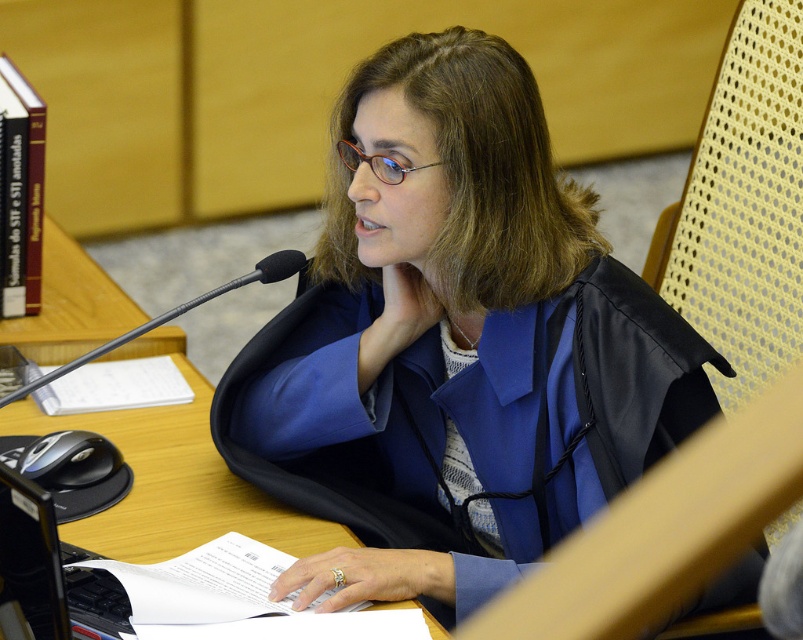
Which is more to the left, blue fabric at center or brown plastic glasses at center?

brown plastic glasses at center is more to the left.

You are a GUI agent. You are given a task and a screenshot of the screen. Output one action in this format:
    pyautogui.click(x=<x>, y=<y>)
    Task: Click on the blue fabric at center
    The image size is (803, 640).
    Given the screenshot: What is the action you would take?
    pyautogui.click(x=455, y=344)

Is black matte microphone at center positioned at the back of brown plastic glasses at center?

No, it is not.

Is black matte microphone at center to the left of brown plastic glasses at center from the viewer's perspective?

Indeed, black matte microphone at center is positioned on the left side of brown plastic glasses at center.

Who is more forward, (298, 253) or (388, 177)?

Point (388, 177) is in front.

The image size is (803, 640). In order to click on black matte microphone at center in this screenshot , I will do coord(174,314).

What do you see at coordinates (174, 483) in the screenshot? This screenshot has height=640, width=803. I see `wooden table at center` at bounding box center [174, 483].

Who is shorter, wooden table at center or brown plastic glasses at center?

brown plastic glasses at center is shorter.

The width and height of the screenshot is (803, 640). Describe the element at coordinates (174, 483) in the screenshot. I see `wooden table at center` at that location.

Find the location of `wooden table at center`. wooden table at center is located at coordinates (174, 483).